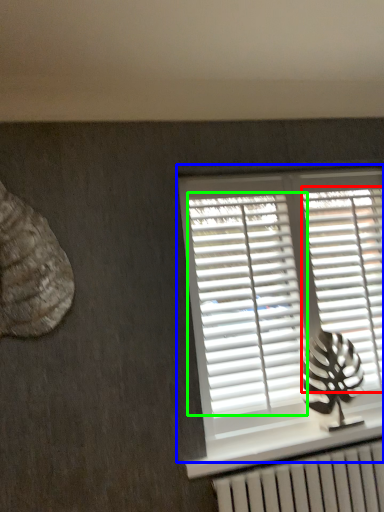
Question: Estimate the real-world distances between objects in this image. Which object is farther from shutter (highlighted by a red box), window (highlighted by a blue box) or shutter (highlighted by a green box)?

Choices:
 (A) window
 (B) shutter

Answer: (B)